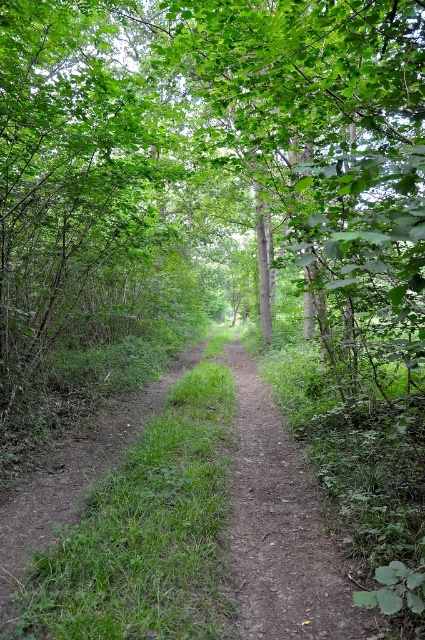
Looking at this image, which of these two, dull brown dirt track at center or dirt path at center, stands taller?

With more height is dirt path at center.

Between dull brown dirt track at center and dirt path at center, which one appears on the left side from the viewer's perspective?

dull brown dirt track at center is more to the left.

What do you see at coordinates (184, 524) in the screenshot? I see `dull brown dirt track at center` at bounding box center [184, 524].

Identify the location of dull brown dirt track at center. This screenshot has width=425, height=640. (184, 524).